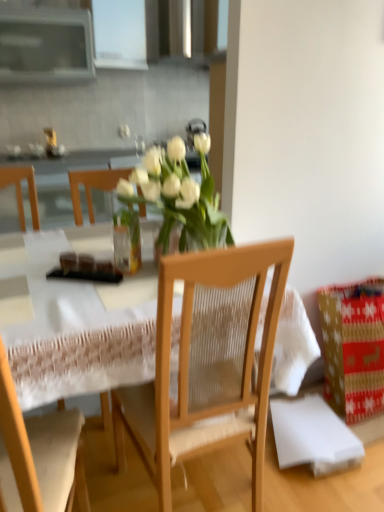
Question: Is there a large distance between wooden chair at center, which is the 2th chair in left-to-right order, and wooden chair at center, which appears as the 1th chair when viewed from the left?

Choices:
 (A) yes
 (B) no

Answer: (B)

Question: Does wooden chair at center, which is the 2th chair in left-to-right order, come behind wooden chair at center, positioned as the 2th chair in right-to-left order?

Choices:
 (A) yes
 (B) no

Answer: (A)

Question: Is wooden chair at center, which is the 2th chair in left-to-right order, next to wooden chair at center, positioned as the 2th chair in right-to-left order?

Choices:
 (A) yes
 (B) no

Answer: (B)

Question: Considering the relative positions of wooden chair at center, placed as the first chair when sorted from right to left, and wooden chair at center, which appears as the 1th chair when viewed from the left, in the image provided, is wooden chair at center, placed as the first chair when sorted from right to left, to the left of wooden chair at center, which appears as the 1th chair when viewed from the left, from the viewer's perspective?

Choices:
 (A) yes
 (B) no

Answer: (B)

Question: Is wooden chair at center, placed as the first chair when sorted from right to left, smaller than wooden chair at center, positioned as the 2th chair in right-to-left order?

Choices:
 (A) no
 (B) yes

Answer: (A)

Question: Is wooden chair at center, placed as the first chair when sorted from right to left, bigger than wooden chair at center, which appears as the 1th chair when viewed from the left?

Choices:
 (A) no
 (B) yes

Answer: (B)

Question: Considering the relative positions of matte brown bread at table and red paper gift at lower right in the image provided, is matte brown bread at table to the left of red paper gift at lower right from the viewer's perspective?

Choices:
 (A) yes
 (B) no

Answer: (A)

Question: Can you confirm if matte brown bread at table is wider than red paper gift at lower right?

Choices:
 (A) yes
 (B) no

Answer: (B)

Question: Is matte brown bread at table with red paper gift at lower right?

Choices:
 (A) no
 (B) yes

Answer: (A)

Question: Is matte brown bread at table at the right side of red paper gift at lower right?

Choices:
 (A) no
 (B) yes

Answer: (A)

Question: Does matte brown bread at table lie in front of red paper gift at lower right?

Choices:
 (A) no
 (B) yes

Answer: (B)

Question: Is matte brown bread at table looking in the opposite direction of red paper gift at lower right?

Choices:
 (A) no
 (B) yes

Answer: (A)

Question: Is red paper gift at lower right bigger than wooden table at center?

Choices:
 (A) no
 (B) yes

Answer: (A)